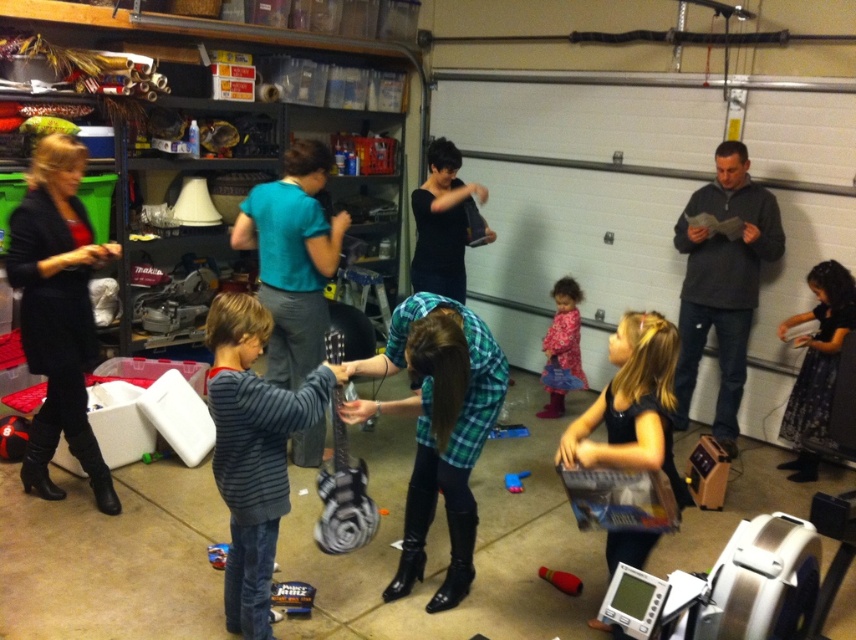
You are organizing a childrens play area in the garage. You need to place the plaid fabric guitar at center and the blue plastic toy at center such that they are both visible to kids playing. According to the scene description, which object should be placed closer to the entrance so it can be seen first when entering?

The plaid fabric guitar at center should be placed closer to the entrance because it is already positioned in front of the blue plastic toy at center, making it naturally more visible upon entering.